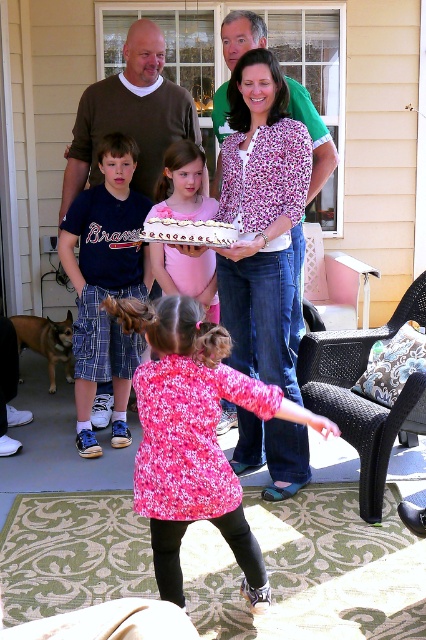
Which is below, matte blue shirt at left or floral blouse at center?

matte blue shirt at left is lower down.

Who is more distant from viewer, [114,364] or [305,100]?

Point [114,364]

Is point (114, 349) closer to camera compared to point (236, 49)?

That is False.

Find the location of a particular element. matte blue shirt at left is located at coordinates (104, 285).

Can you confirm if pink floral dress at center is positioned below matte blue shirt at left?

Yes.

Who is shorter, pink floral dress at center or matte blue shirt at left?

pink floral dress at center

Locate an element on the screen. This screenshot has height=640, width=426. pink floral dress at center is located at coordinates (195, 436).

You are a GUI agent. You are given a task and a screenshot of the screen. Output one action in this format:
    pyautogui.click(x=<x>, y=<y>)
    Task: Click on the pink floral dress at center
    
    Given the screenshot: What is the action you would take?
    pyautogui.click(x=195, y=436)

Is pink floral dress at center taller than white frosted cake at center?

Indeed, pink floral dress at center has a greater height compared to white frosted cake at center.

Where is `pink floral dress at center`? This screenshot has height=640, width=426. pink floral dress at center is located at coordinates (195, 436).